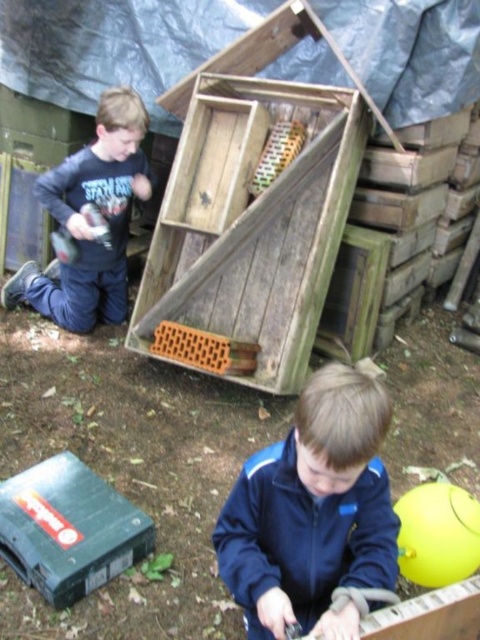
You are a parent observing two children playing in the backyard. You notice the dark blue jacket at center and the dark blue fleece at left. Which child is sitting closer to you?

The dark blue jacket at center is shorter than the dark blue fleece at left, so the child wearing the dark blue jacket at center is sitting closer to you.

You are standing in the outdoor play area and want to move from point A to point B. Point A is at coordinate point (323, 547) and point B is at coordinate point (22, 282). Which point is closer to you?

Point A at coordinate point (323, 547) is closer to you than point B at coordinate point (22, 282).